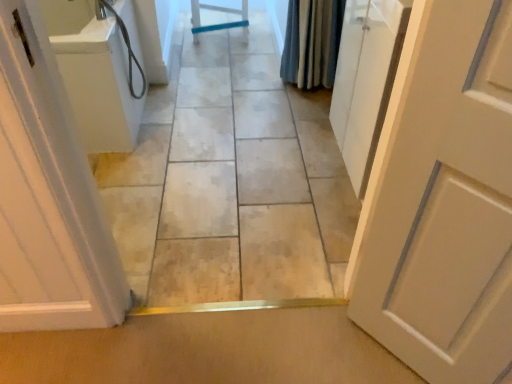
At what (x,y) coordinates should I click in order to perform the action: click on empty space that is ontop of smooth tile floor at center (from a real-world perspective). Please return your answer as a coordinate pair (x, y). The width and height of the screenshot is (512, 384). Looking at the image, I should click on (203, 132).